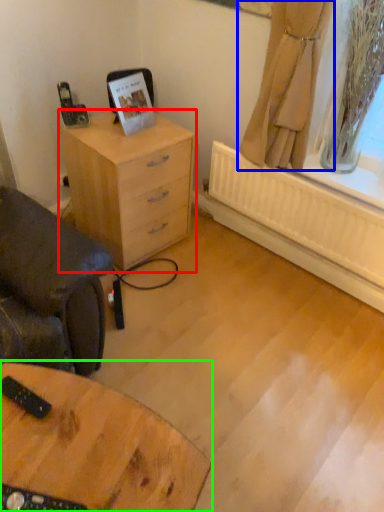
Question: Based on their relative distances, which object is nearer to chest of drawers (highlighted by a red box)? Choose from curtain (highlighted by a blue box) and table (highlighted by a green box).

Choices:
 (A) curtain
 (B) table

Answer: (A)